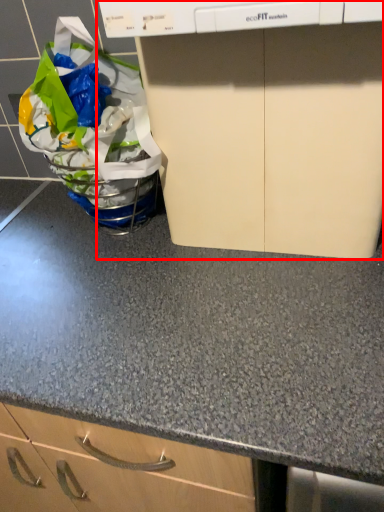
Question: Where is home appliance (annotated by the red box) located in relation to grocery bag in the image?

Choices:
 (A) right
 (B) left

Answer: (A)